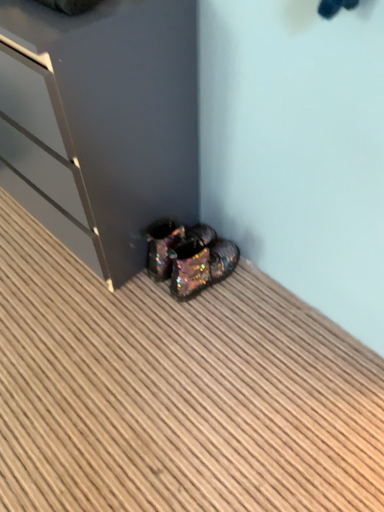
Question: Choose the correct answer: Is glossy dark gray dresser at lower left inside iridescent metallic shoes at lower center or outside it?

Choices:
 (A) inside
 (B) outside

Answer: (B)

Question: Is glossy dark gray dresser at lower left taller or shorter than iridescent metallic shoes at lower center?

Choices:
 (A) tall
 (B) short

Answer: (A)

Question: Estimate the real-world distances between objects in this image. Which object is farther from the iridescent glittery shoes at lower center?

Choices:
 (A) iridescent metallic shoes at lower center
 (B) glossy dark gray dresser at lower left

Answer: (A)

Question: Which object is positioned farthest from the glossy dark gray dresser at lower left?

Choices:
 (A) iridescent metallic shoes at lower center
 (B) iridescent glittery shoes at lower center

Answer: (A)